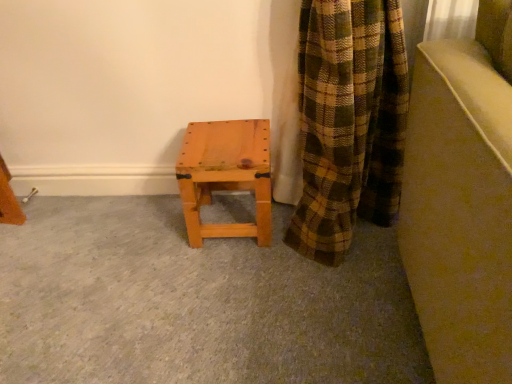
This screenshot has width=512, height=384. I want to click on free spot above natural wood stool at center (from a real-world perspective), so pos(224,134).